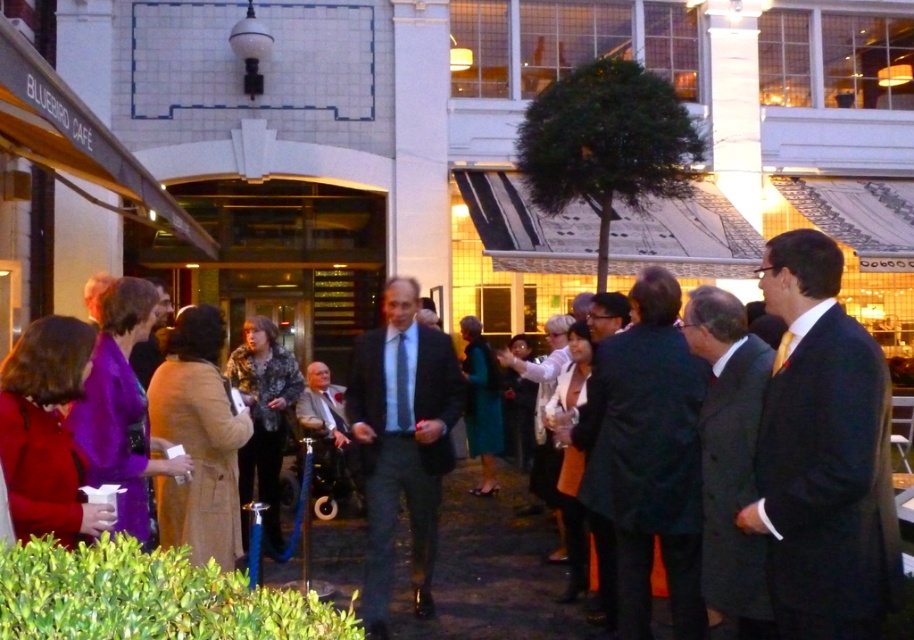
Between black wool coat at center and gray fabric suit at center, which one has less height?

gray fabric suit at center is shorter.

Is point (624, 593) closer to viewer compared to point (319, 452)?

Yes, it is in front of point (319, 452).

This screenshot has width=914, height=640. In order to click on black wool coat at center in this screenshot , I will do click(x=646, y=468).

Is dark suit at right to the right of gray fabric suit at center from the viewer's perspective?

Yes, dark suit at right is to the right of gray fabric suit at center.

Is dark suit at right shorter than gray fabric suit at center?

In fact, dark suit at right may be taller than gray fabric suit at center.

Between point (821, 628) and point (309, 396), which one is positioned in front?

Point (821, 628) is more forward.

Locate an element on the screen. dark suit at right is located at coordinates (x=824, y=454).

Is point (777, 557) in front of point (396, 280)?

Yes.

The height and width of the screenshot is (640, 914). Identify the location of dark suit at right. (824, 454).